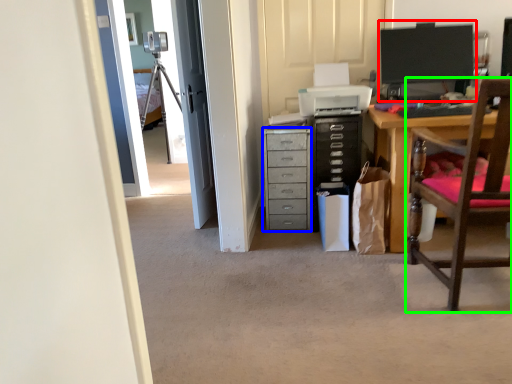
Question: Which is nearer to the computer monitor (highlighted by a red box)? chest of drawers (highlighted by a blue box) or chair (highlighted by a green box).

Choices:
 (A) chest of drawers
 (B) chair

Answer: (A)